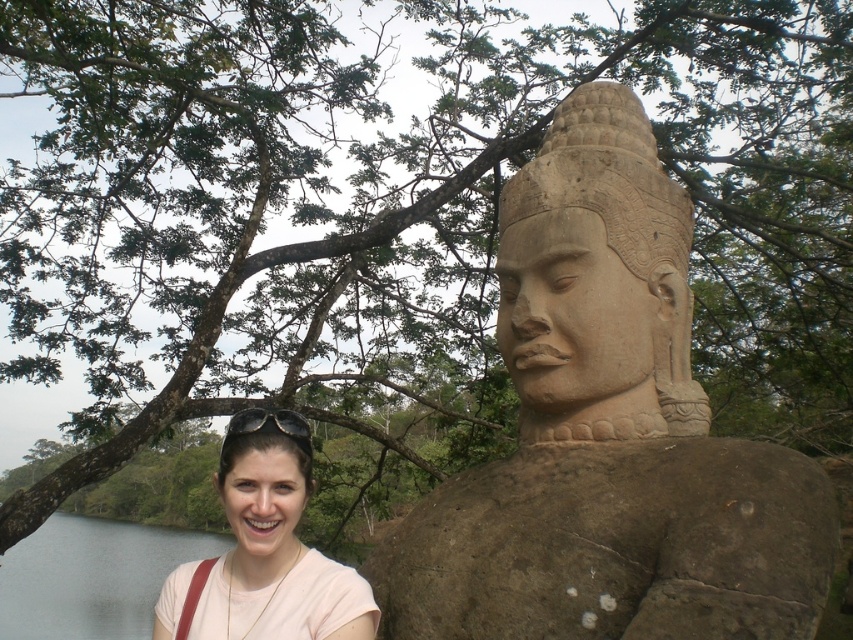
Which is more to the left, brown stone statue at center or matte pink head at lower left?

matte pink head at lower left is more to the left.

Consider the image. Is brown stone statue at center positioned in front of matte pink head at lower left?

Yes.

Locate an element on the screen. The width and height of the screenshot is (853, 640). brown stone statue at center is located at coordinates (607, 435).

Measure the distance between matte pink shirt at lower left and matte pink head at lower left.

The distance of matte pink shirt at lower left from matte pink head at lower left is 5.82 inches.

This screenshot has width=853, height=640. I want to click on matte pink shirt at lower left, so click(x=265, y=550).

Is stone statue head at center bigger than matte pink head at lower left?

Correct, stone statue head at center is larger in size than matte pink head at lower left.

Which of these two, stone statue head at center or matte pink head at lower left, stands taller?

With more height is stone statue head at center.

Where is `stone statue head at center`? The width and height of the screenshot is (853, 640). stone statue head at center is located at coordinates (622, 218).